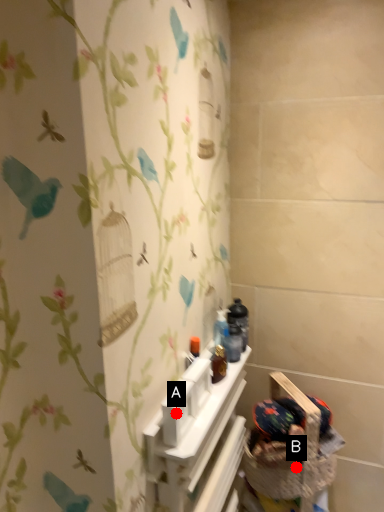
Question: Two points are circled on the image, labeled by A and B beside each circle. Which point appears closest to the camera in this image?

Choices:
 (A) A is closer
 (B) B is closer

Answer: (A)